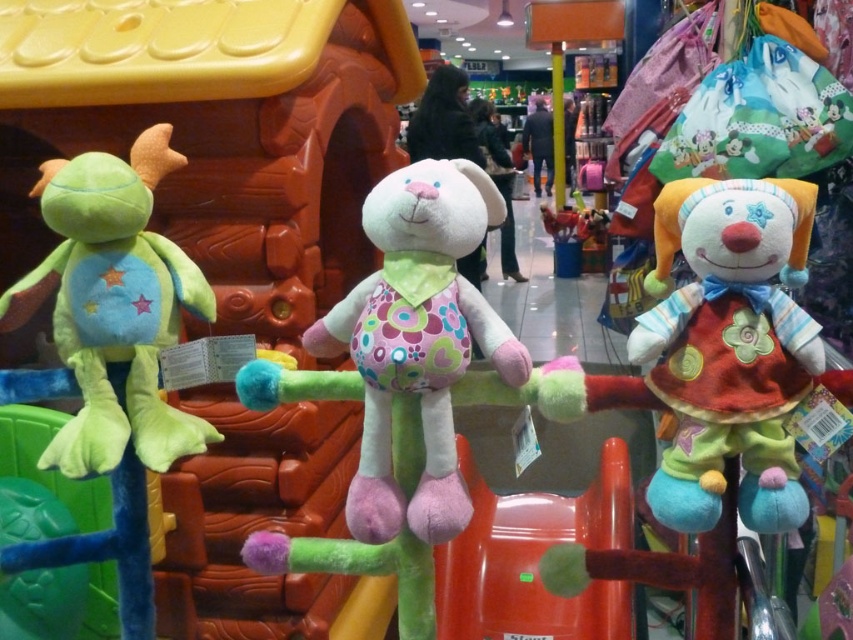
You are a customer trying to decide which toy to buy. You want to choose the wider toy between the fluffy white plush rabbit at center and the green plush turtle at left. Which one should you pick?

The fluffy white plush rabbit at center might be wider than green plush turtle at left according to the description, so you should pick the fluffy white plush rabbit at center.

You are a parent trying to choose between the fluffy multicolored clown doll at right and the green plush turtle at left for your child. Considering their sizes, which one is taller?

The green plush turtle at left is taller than the fluffy multicolored clown doll at right.